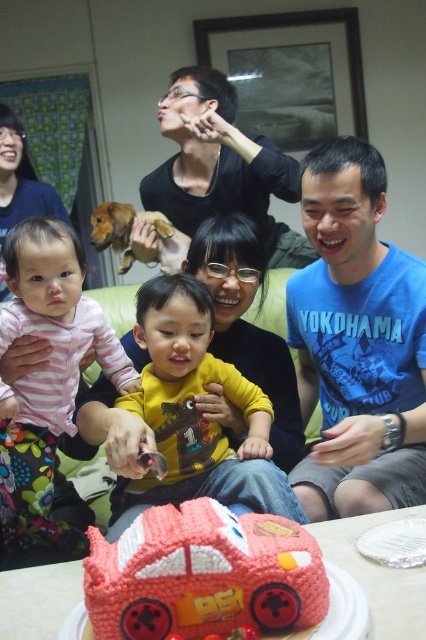
Question: Does blue cotton shirt at center lie in front of yellow matte shirt at center?

Choices:
 (A) no
 (B) yes

Answer: (B)

Question: Which point is closer to the camera?

Choices:
 (A) [x=198, y=387]
 (B) [x=411, y=266]
 (C) [x=37, y=237]
 (D) [x=169, y=84]

Answer: (C)

Question: Is smooth red car at center below striped fabric baby at left?

Choices:
 (A) no
 (B) yes

Answer: (B)

Question: Which of the following is the closest to the observer?

Choices:
 (A) blue cotton shirt at center
 (B) yellow matte shirt at center

Answer: (A)

Question: Can you confirm if yellow matte shirt at center is positioned above striped fabric baby at left?

Choices:
 (A) no
 (B) yes

Answer: (A)

Question: Which point is farther from the camera taking this photo?

Choices:
 (A) (325, 376)
 (B) (138, 227)

Answer: (B)